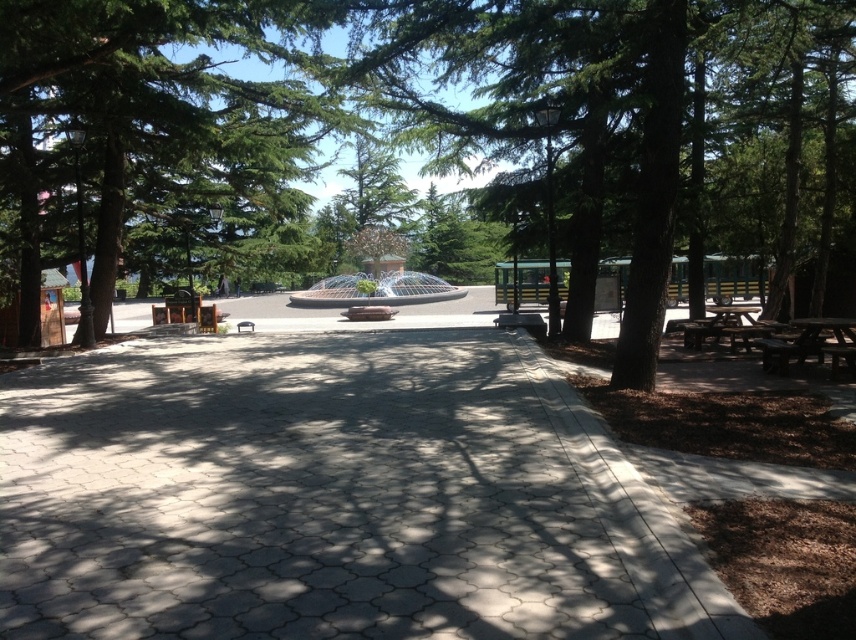
Question: Is green textured tree at center smaller than green leafy tree at center?

Choices:
 (A) yes
 (B) no

Answer: (B)

Question: Among these objects, which one is nearest to the camera?

Choices:
 (A) green leafy tree at center
 (B) brown wooden picnic table at lower right

Answer: (B)

Question: Which object appears closest to the camera in this image?

Choices:
 (A) brown wooden picnic table at lower right
 (B) green leafy tree at center
 (C) gray concrete pavement at center

Answer: (C)

Question: Which object is the closest to the gray concrete pavement at center?

Choices:
 (A) brown wooden picnic table at lower right
 (B) green textured tree at center
 (C) green leafy tree at center

Answer: (A)

Question: Is green leafy tree at center bigger than brown wooden picnic table at lower right?

Choices:
 (A) no
 (B) yes

Answer: (A)

Question: Is green textured tree at center further to camera compared to brown wooden picnic table at lower right?

Choices:
 (A) yes
 (B) no

Answer: (B)